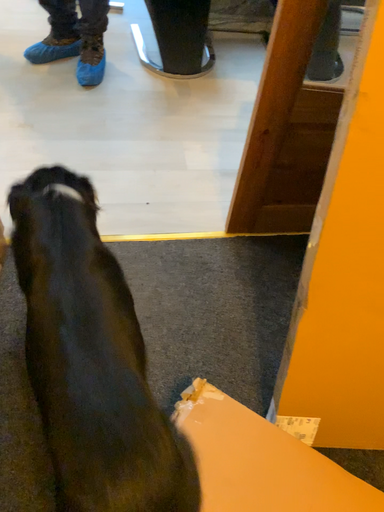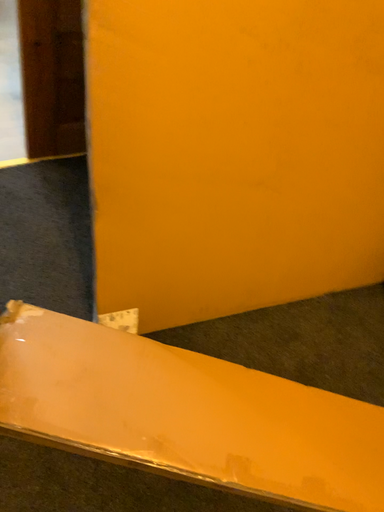
Question: How did the camera likely rotate when shooting the video?

Choices:
 (A) rotated upward
 (B) rotated downward

Answer: (B)